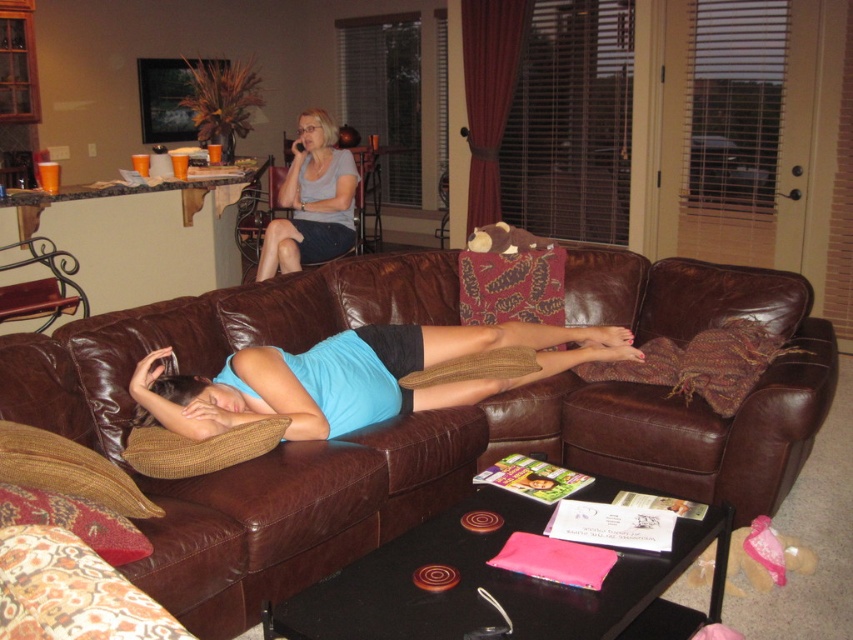
You are standing in the living room and want to place a small book on the blue fabric pillow at center. Based on its 2D coordinates, where exactly should you aim to place the book?

The blue fabric pillow at center is located at point [355,376] in 2D coordinates, so you should aim for that exact coordinate to place the small book.

You are standing in the living room and want to place a small plant on the blue fabric pillow at center. The coordinates provided indicate the center point of the pillow. Can you confirm if the point at coordinates (355,376) is indeed on the blue fabric pillow at center?

Yes, the point at coordinates (355,376) is on the blue fabric pillow at center, as stated in the objects description.

You are standing in the living room and want to place a small plant on the closest object to you between the brown leather couch at center and the blue fabric pillow at center. Which object should you choose?

The brown leather couch at center is closer to the viewer than the blue fabric pillow at center, so you should place the small plant on the brown leather couch at center.